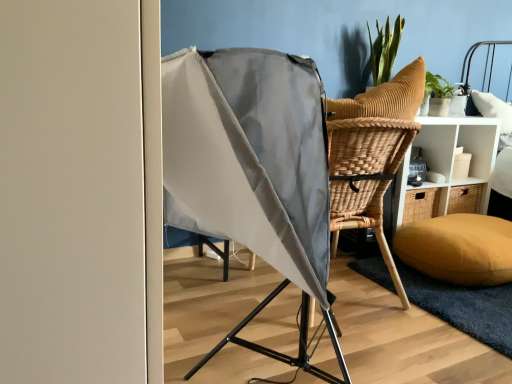
Question: Is soft yellow mat at lower right aimed at brown wicker chair at center right?

Choices:
 (A) yes
 (B) no

Answer: (B)

Question: Is soft yellow mat at lower right looking in the opposite direction of brown wicker chair at center right?

Choices:
 (A) no
 (B) yes

Answer: (A)

Question: Considering the relative sizes of soft yellow mat at lower right and brown wicker chair at center right in the image provided, is soft yellow mat at lower right smaller than brown wicker chair at center right?

Choices:
 (A) yes
 (B) no

Answer: (A)

Question: Can you confirm if soft yellow mat at lower right is wider than brown wicker chair at center right?

Choices:
 (A) yes
 (B) no

Answer: (A)

Question: From a real-world perspective, is soft yellow mat at lower right on top of brown wicker chair at center right?

Choices:
 (A) yes
 (B) no

Answer: (B)

Question: Is brown wicker chair at center right situated inside soft yellow mat at lower right or outside?

Choices:
 (A) outside
 (B) inside

Answer: (A)

Question: Is point (493, 145) positioned closer to the camera than point (372, 264)?

Choices:
 (A) closer
 (B) farther

Answer: (B)

Question: Based on their sizes in the image, would you say brown wicker chair at center right is bigger or smaller than soft yellow mat at lower right?

Choices:
 (A) big
 (B) small

Answer: (A)

Question: From the image's perspective, is brown wicker chair at center right above or below soft yellow mat at lower right?

Choices:
 (A) below
 (B) above

Answer: (B)

Question: From the image's perspective, is soft yellow mat at lower right positioned above or below mustard yellow fabric pillow at lower right?

Choices:
 (A) below
 (B) above

Answer: (A)

Question: In terms of width, does soft yellow mat at lower right look wider or thinner when compared to mustard yellow fabric pillow at lower right?

Choices:
 (A) wide
 (B) thin

Answer: (B)

Question: Based on their positions, is soft yellow mat at lower right located to the left or right of mustard yellow fabric pillow at lower right?

Choices:
 (A) right
 (B) left

Answer: (B)

Question: Is soft yellow mat at lower right bigger or smaller than mustard yellow fabric pillow at lower right?

Choices:
 (A) big
 (B) small

Answer: (B)

Question: From a real-world perspective, is mustard yellow fabric pillow at lower right positioned above or below brown wicker chair at center right?

Choices:
 (A) above
 (B) below

Answer: (B)

Question: In the image, is mustard yellow fabric pillow at lower right positioned in front of or behind brown wicker chair at center right?

Choices:
 (A) front
 (B) behind

Answer: (A)